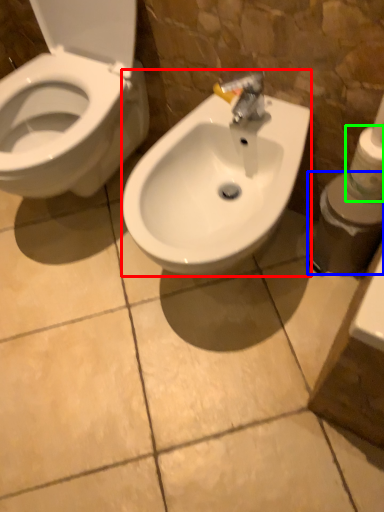
Question: Which is nearer to the sink (highlighted by a red box)? toiletries (highlighted by a blue box) or toilet paper (highlighted by a green box).

Choices:
 (A) toiletries
 (B) toilet paper

Answer: (A)